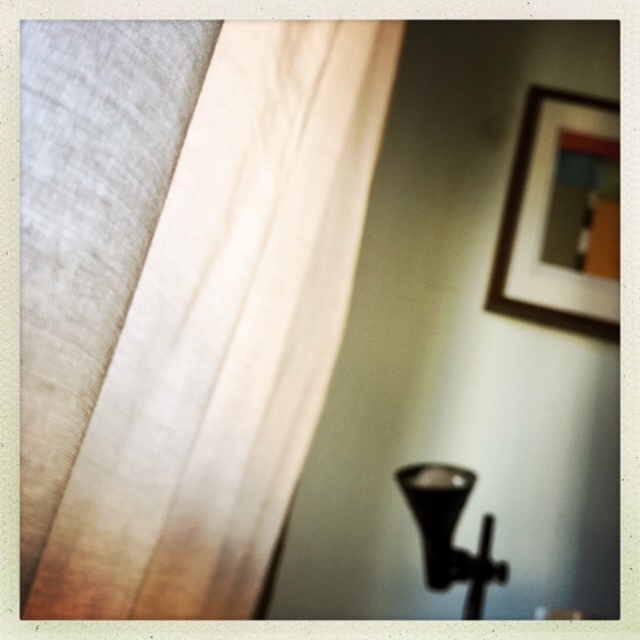
You are an interior designer assessing the placement of items on a wooden surface. You notice the wooden framed artwork at upper right and the matte glass window at upper right. Which object takes up more space on the surface?

The wooden framed artwork at upper right is bigger than the matte glass window at upper right, so it takes up more space on the surface.

You are standing in a room and notice a matte white curtain at upper left. Based on its position, can you determine if it is closer to the wall with the framed picture or the wooden surface in the foreground?

The matte white curtain at upper left is located at point (227, 332), which places it closer to the wooden surface in the foreground rather than the wall with the framed picture.